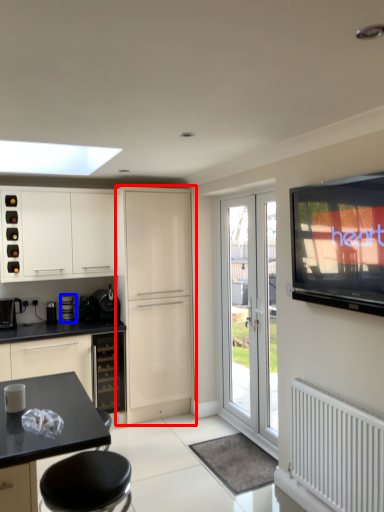
Question: Which of the following is the farthest to the observer, cabinetry (highlighted by a red box) or appliance (highlighted by a blue box)?

Choices:
 (A) cabinetry
 (B) appliance

Answer: (B)